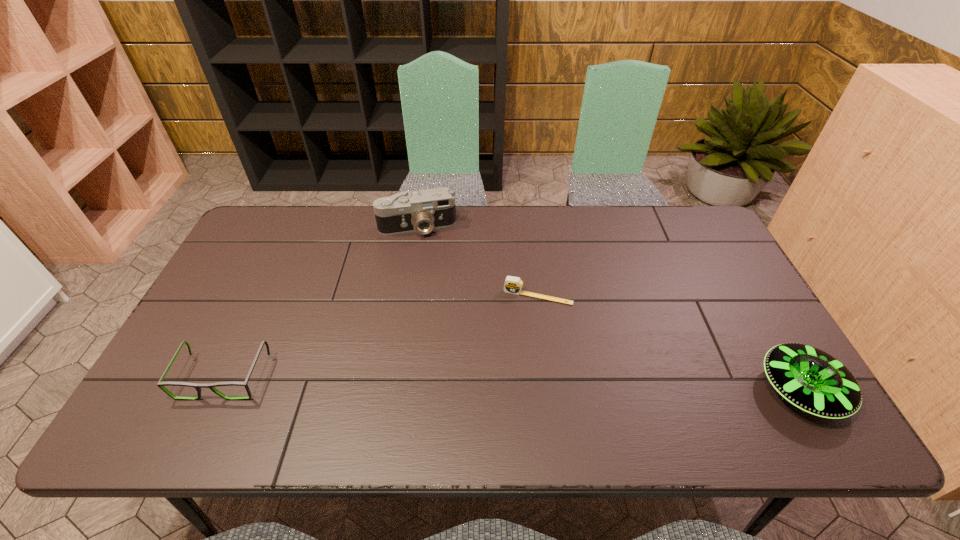
You are a GUI agent. You are given a task and a screenshot of the screen. Output one action in this format:
    pyautogui.click(x=<x>, y=<y>)
    Task: Click on the spectacles
    
    Given the screenshot: What is the action you would take?
    pyautogui.click(x=160, y=384)

The height and width of the screenshot is (540, 960). What are the coordinates of `the leftmost object` in the screenshot? It's located at (160, 384).

The image size is (960, 540). What are the coordinates of `the third shortest object` in the screenshot? It's located at (810, 379).

This screenshot has width=960, height=540. I want to click on saucer, so click(810, 379).

I want to click on the tallest object, so click(405, 212).

Where is `camera`? The image size is (960, 540). camera is located at coordinates (405, 212).

The image size is (960, 540). What are the coordinates of `the shortest object` in the screenshot? It's located at (513, 285).

Find the location of a particular element. Image resolution: width=960 pixels, height=540 pixels. the second object from right to left is located at coordinates (513, 285).

Locate an element on the screen. This screenshot has width=960, height=540. blank space located 0.340m on the left of the rightmost object is located at coordinates (615, 390).

This screenshot has height=540, width=960. In order to click on free space located 0.240m on the lens of the tallest object in this screenshot , I will do `click(435, 292)`.